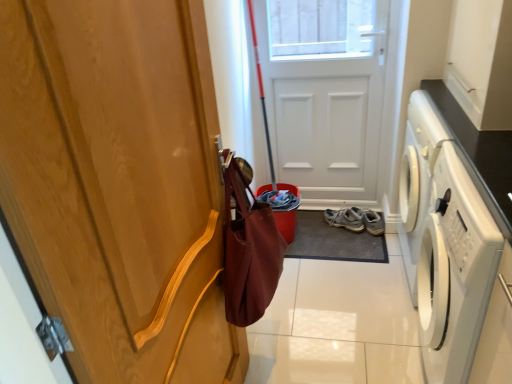
At what (x,y) coordinates should I click in order to perform the action: click on vacant area that lies in front of light brown suede sneakers at lower center. Please return your answer as a coordinate pair (x, y). This screenshot has height=384, width=512. Looking at the image, I should click on (352, 243).